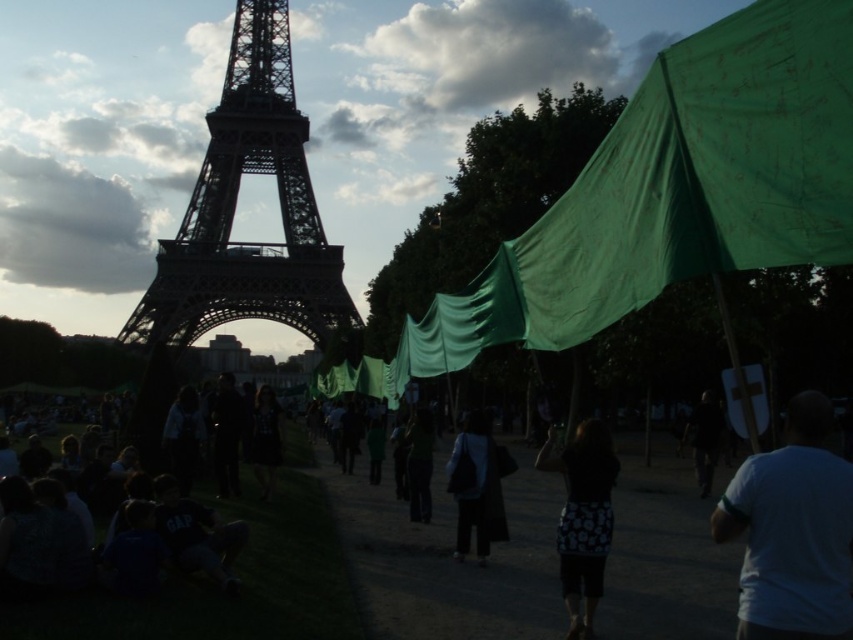
You are standing at the Champ de Mars near the Eiffel Tower and want to take a photo of two specific points in the scene. The first point is at coordinates point (763, 570) and the second is at point (712, 456). Which point should you focus on first if you want to capture the one that is closer to you?

Point (763, 570) is closer to the viewer than point (712, 456), so you should focus on point (763, 570) first.

You are a photographer trying to capture the dark steel eiffel tower at center and the black fabric skirt at lower center in the same frame. Which object will appear bigger in your photo?

The dark steel eiffel tower at center will appear bigger in the photo because it has a larger size compared to the black fabric skirt at lower center.